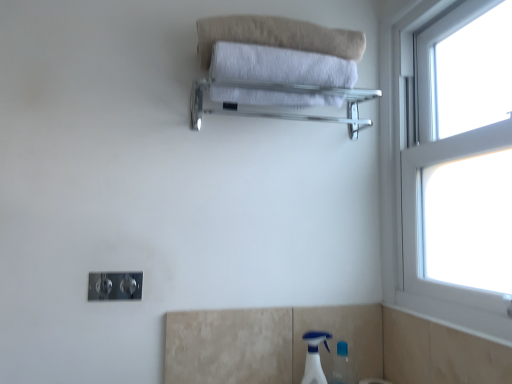
Question: Does clear glass towel rack at upper center have a lesser width compared to white soft towel at upper center?

Choices:
 (A) no
 (B) yes

Answer: (A)

Question: Can you confirm if clear glass towel rack at upper center is wider than white soft towel at upper center?

Choices:
 (A) no
 (B) yes

Answer: (B)

Question: Is clear glass towel rack at upper center positioned with its back to white soft towel at upper center?

Choices:
 (A) no
 (B) yes

Answer: (A)

Question: From the image's perspective, is clear glass towel rack at upper center above white soft towel at upper center?

Choices:
 (A) yes
 (B) no

Answer: (B)

Question: Is clear glass towel rack at upper center shorter than white soft towel at upper center?

Choices:
 (A) no
 (B) yes

Answer: (A)

Question: From the image's perspective, relative to white plastic window at right, is beige cotton towel at upper center above or below?

Choices:
 (A) above
 (B) below

Answer: (A)

Question: Is point (343, 41) positioned closer to the camera than point (399, 241)?

Choices:
 (A) farther
 (B) closer

Answer: (B)

Question: Is beige cotton towel at upper center situated inside white plastic window at right or outside?

Choices:
 (A) outside
 (B) inside

Answer: (A)

Question: Is beige cotton towel at upper center wider or thinner than white plastic window at right?

Choices:
 (A) thin
 (B) wide

Answer: (B)

Question: Is white plastic spray bottle at lower right taller or shorter than beige cotton towel at upper center?

Choices:
 (A) tall
 (B) short

Answer: (A)

Question: From a real-world perspective, relative to beige cotton towel at upper center, is white plastic spray bottle at lower right vertically above or below?

Choices:
 (A) below
 (B) above

Answer: (A)

Question: Would you say white plastic spray bottle at lower right is inside or outside beige cotton towel at upper center?

Choices:
 (A) outside
 (B) inside

Answer: (A)

Question: In terms of width, does white plastic spray bottle at lower right look wider or thinner when compared to beige cotton towel at upper center?

Choices:
 (A) thin
 (B) wide

Answer: (A)

Question: In terms of width, does beige cotton towel at upper center look wider or thinner when compared to white plastic spray bottle at lower right?

Choices:
 (A) thin
 (B) wide

Answer: (B)

Question: Considering the positions of beige cotton towel at upper center and white plastic spray bottle at lower right in the image, is beige cotton towel at upper center bigger or smaller than white plastic spray bottle at lower right?

Choices:
 (A) big
 (B) small

Answer: (A)